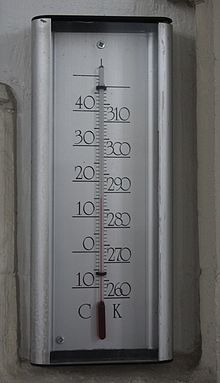
Locate an element on the screen. glass is located at coordinates (101, 258).